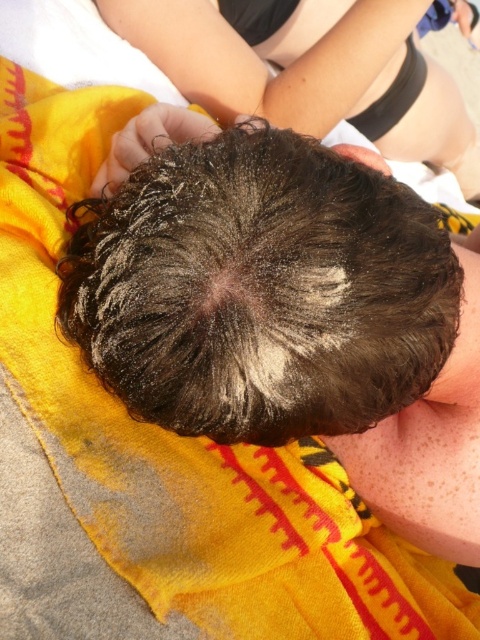
Question: Does dark brown hair at center have a greater width compared to dry skin at center?

Choices:
 (A) no
 (B) yes

Answer: (B)

Question: Which point appears farthest from the camera in this image?

Choices:
 (A) (183, 93)
 (B) (282, 232)

Answer: (A)

Question: Can you confirm if dark brown curly hair at center is positioned below dry skin at center?

Choices:
 (A) no
 (B) yes

Answer: (A)

Question: Which object is farther from the camera taking this photo?

Choices:
 (A) dry skin at center
 (B) dark brown curly hair at center
 (C) dark brown hair at center

Answer: (C)

Question: Which point is closer to the camera taking this photo?

Choices:
 (A) (311, 48)
 (B) (469, 248)
 (C) (456, 304)

Answer: (C)

Question: Is dark brown curly hair at center bigger than dry skin at center?

Choices:
 (A) no
 (B) yes

Answer: (A)